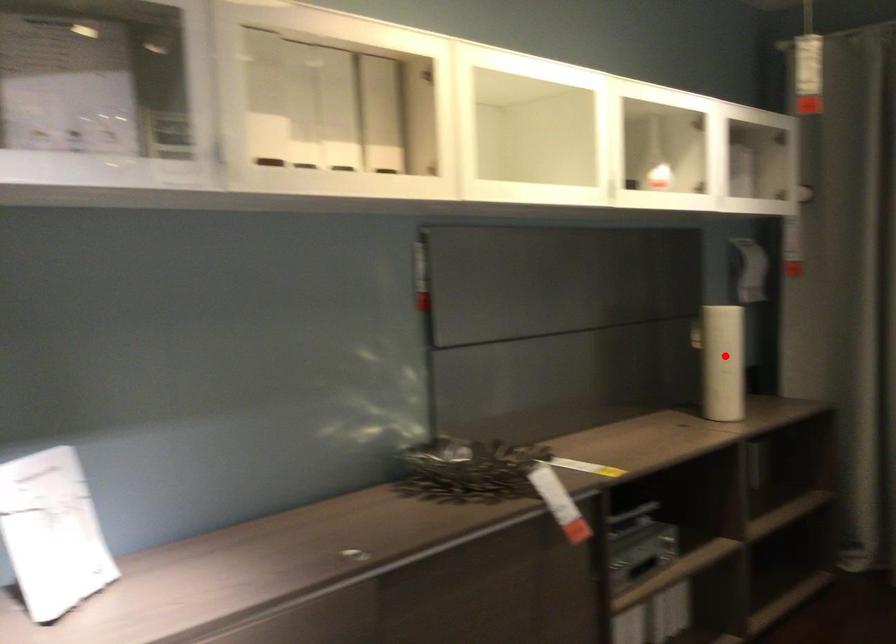
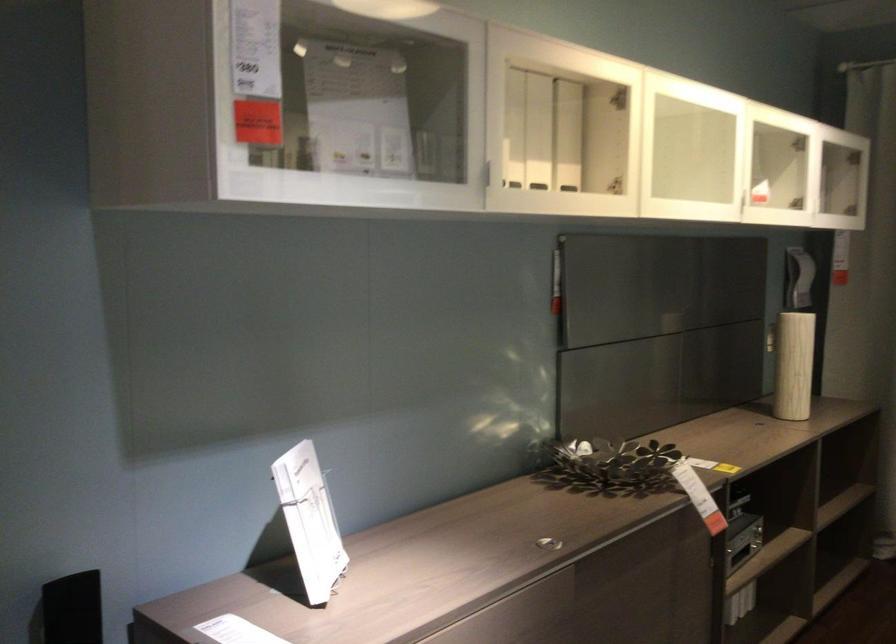
Question: I am providing you with two images of the same scene from different viewpoints. A red point is shown in image1. For the corresponding object point in image2, is it positioned nearer or farther from the camera?

Choices:
 (A) Nearer
 (B) Farther

Answer: (B)